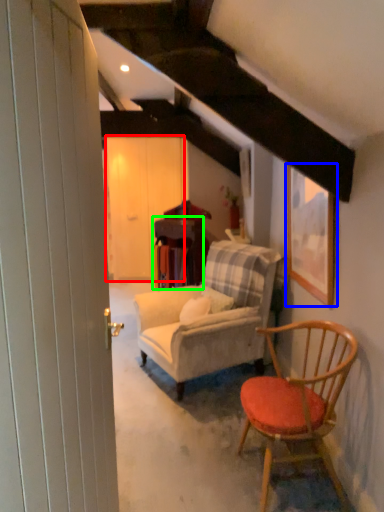
Question: Which object is the farthest from barn door (highlighted by a red box)? Choose among these: picture frame (highlighted by a blue box) or table (highlighted by a green box).

Choices:
 (A) picture frame
 (B) table

Answer: (A)